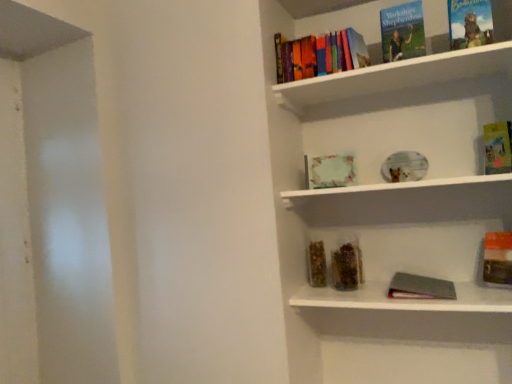
Question: From the image's perspective, is gray matte book at lower right, which is counted as the 8th book, starting from the top, on white matte plate at center, which is counted as the 1th window sill, starting from the top?

Choices:
 (A) no
 (B) yes

Answer: (A)

Question: From a real-world perspective, is gray matte book at lower right, placed as the 1th book when sorted from bottom to top, physically below white matte plate at center, which is counted as the 1th window sill, starting from the top?

Choices:
 (A) yes
 (B) no

Answer: (A)

Question: Is gray matte book at lower right, placed as the 1th book when sorted from bottom to top, at the right side of white matte plate at center, which is counted as the 1th window sill, starting from the top?

Choices:
 (A) no
 (B) yes

Answer: (B)

Question: Does gray matte book at lower right, placed as the 1th book when sorted from bottom to top, contain white matte plate at center, the 2th window sill ordered from the bottom?

Choices:
 (A) no
 (B) yes

Answer: (A)

Question: Can we say gray matte book at lower right, placed as the 1th book when sorted from bottom to top, lies outside white matte plate at center, the 2th window sill ordered from the bottom?

Choices:
 (A) yes
 (B) no

Answer: (A)

Question: Is gray matte book at lower right, placed as the 1th book when sorted from bottom to top, taller than white matte plate at center, the 2th window sill ordered from the bottom?

Choices:
 (A) no
 (B) yes

Answer: (B)

Question: Considering the relative sizes of white matte plate at center, which is counted as the 1th window sill, starting from the top, and metallic silver book at lower center, the second window sill when ordered from top to bottom, in the image provided, is white matte plate at center, which is counted as the 1th window sill, starting from the top, bigger than metallic silver book at lower center, the second window sill when ordered from top to bottom,?

Choices:
 (A) no
 (B) yes

Answer: (B)

Question: Considering the relative sizes of white matte plate at center, the 2th window sill ordered from the bottom, and metallic silver book at lower center, the second window sill when ordered from top to bottom, in the image provided, is white matte plate at center, the 2th window sill ordered from the bottom, shorter than metallic silver book at lower center, the second window sill when ordered from top to bottom,?

Choices:
 (A) yes
 (B) no

Answer: (B)

Question: Considering the relative sizes of white matte plate at center, the 2th window sill ordered from the bottom, and metallic silver book at lower center, the second window sill when ordered from top to bottom, in the image provided, is white matte plate at center, the 2th window sill ordered from the bottom, wider than metallic silver book at lower center, the second window sill when ordered from top to bottom,?

Choices:
 (A) no
 (B) yes

Answer: (A)

Question: Is white matte plate at center, which is counted as the 1th window sill, starting from the top, facing towards metallic silver book at lower center, arranged as the 1th window sill when ordered from the bottom?

Choices:
 (A) no
 (B) yes

Answer: (A)

Question: Is white matte plate at center, the 2th window sill ordered from the bottom, surrounding metallic silver book at lower center, the second window sill when ordered from top to bottom?

Choices:
 (A) yes
 (B) no

Answer: (B)

Question: From a real-world perspective, is white matte plate at center, the 2th window sill ordered from the bottom, positioned under metallic silver book at lower center, the second window sill when ordered from top to bottom, based on gravity?

Choices:
 (A) yes
 (B) no

Answer: (B)

Question: Can you confirm if gray matte book at lower right, which is counted as the 8th book, starting from the top, is bigger than hardcover books at upper center?

Choices:
 (A) no
 (B) yes

Answer: (A)